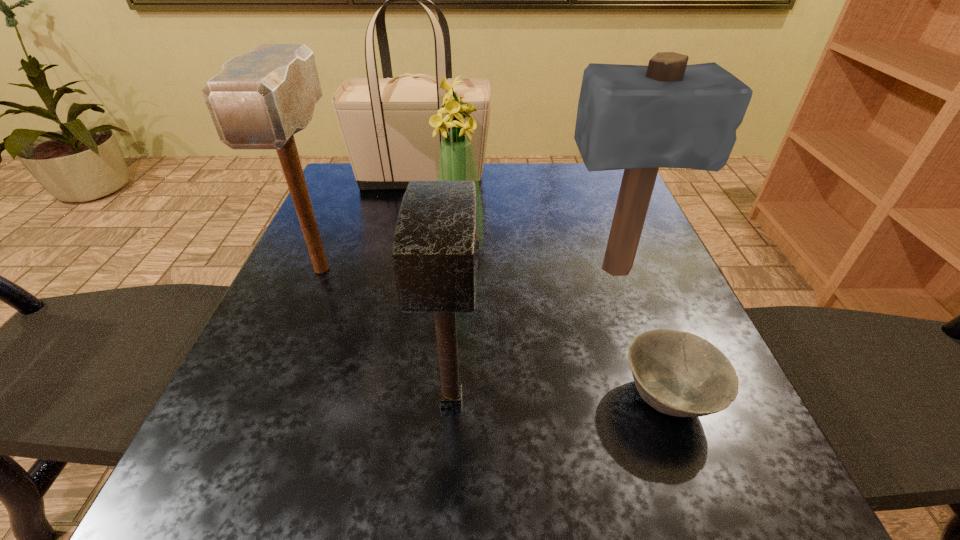
Find the location of a particular element. free spot between the leftmost mallet and the shortest object is located at coordinates (494, 333).

Locate an element on the screen. This screenshot has height=540, width=960. free spot between the farthest object and the bowl is located at coordinates click(544, 287).

Where is `free space between the shortest mallet and the rightmost mallet`? free space between the shortest mallet and the rightmost mallet is located at coordinates (533, 335).

This screenshot has width=960, height=540. Find the location of `object that is the third closest to the rightmost mallet`. object that is the third closest to the rightmost mallet is located at coordinates (435, 250).

Identify which object is the fifth nearest to the shortest object. Please provide its 2D coordinates. Your answer should be formatted as a tuple, i.e. [(x, y)], where the tuple contains the x and y coordinates of a point satisfying the conditions above.

[(384, 122)]

Identify which mallet is located as the second nearest to the leftmost mallet. Please provide its 2D coordinates. Your answer should be formatted as a tuple, i.e. [(x, y)], where the tuple contains the x and y coordinates of a point satisfying the conditions above.

[(668, 114)]

The height and width of the screenshot is (540, 960). Find the location of `mallet that is the second closest one to the rightmost mallet`. mallet that is the second closest one to the rightmost mallet is located at coordinates (259, 100).

Where is `free space that satisfies the following two spatial constraints: 1. on the front-facing side of the bouquet; 2. on the left side of the bowl`? The width and height of the screenshot is (960, 540). free space that satisfies the following two spatial constraints: 1. on the front-facing side of the bouquet; 2. on the left side of the bowl is located at coordinates (452, 397).

This screenshot has width=960, height=540. In order to click on vacant point that satisfies the following two spatial constraints: 1. with handles facing forward on the shopping bag; 2. on the left side of the second mallet from right to left in this screenshot , I will do `click(377, 400)`.

The width and height of the screenshot is (960, 540). In order to click on vacant area that satisfies the following two spatial constraints: 1. on the front-facing side of the bouquet; 2. on the left side of the rightmost mallet in this screenshot , I will do `click(459, 270)`.